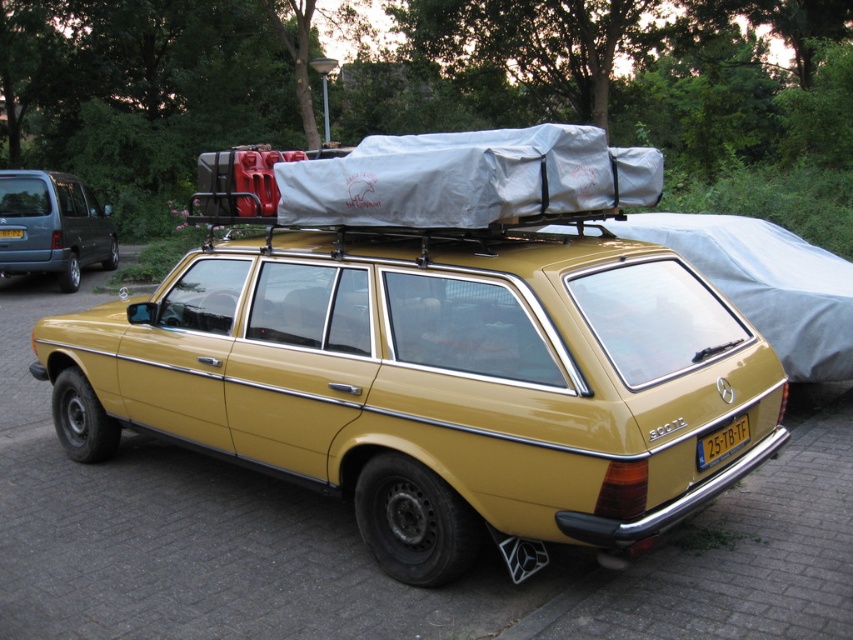
Question: Which point is farther to the camera?

Choices:
 (A) gold matte station wagon at center
 (B) yellow plastic license plate at lower right
 (C) metallic gray minivan at left
 (D) yellow plastic license plate at rear

Answer: (D)

Question: Does yellow plastic license plate at lower right appear on the right side of yellow plastic license plate at rear?

Choices:
 (A) no
 (B) yes

Answer: (B)

Question: Which object appears farthest from the camera in this image?

Choices:
 (A) metallic gray minivan at left
 (B) yellow plastic license plate at rear
 (C) yellow plastic license plate at lower right

Answer: (B)

Question: Which object is farther from the camera taking this photo?

Choices:
 (A) gold matte station wagon at center
 (B) metallic gray minivan at left
 (C) yellow plastic license plate at lower right
 (D) yellow plastic license plate at rear

Answer: (D)

Question: Can you confirm if gold matte station wagon at center is positioned below yellow plastic license plate at lower right?

Choices:
 (A) yes
 (B) no

Answer: (B)

Question: Can you confirm if gold matte station wagon at center is thinner than yellow plastic license plate at rear?

Choices:
 (A) no
 (B) yes

Answer: (A)